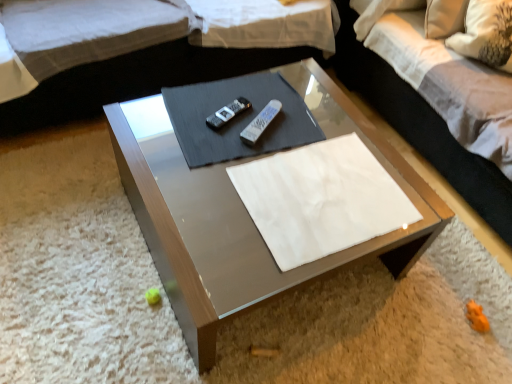
Locate an element on the screen. free space to the left of black plastic remote at center, placed as the first remote when sorted from left to right is located at coordinates click(x=185, y=110).